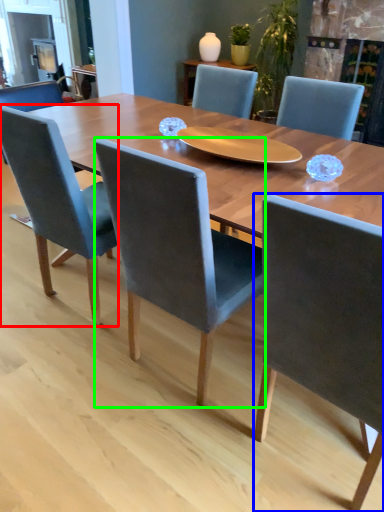
Question: Based on their relative distances, which object is nearer to chair (highlighted by a red box)? Choose from chair (highlighted by a blue box) and chair (highlighted by a green box).

Choices:
 (A) chair
 (B) chair

Answer: (B)